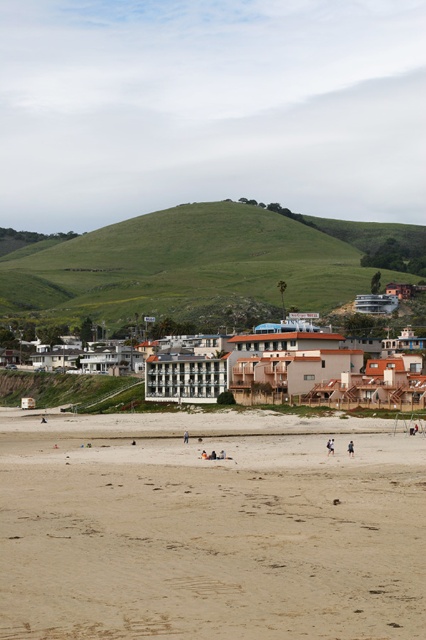
You are standing on the sandy beach in the foreground and want to reach the green grassy hillside at upper center. Which direction should you walk to get there?

The green grassy hillside at upper center is located at point (196,266), so you should walk towards the upper center direction to reach it.

You are standing at the point marked as point (43, 257) on a map of the beach. You want to walk to the water. Is the path from your current location to the water uphill or downhill?

The path from point (43, 257) to the water is downhill because the beach has a gentle slope leading up to the beach from the waterline, meaning the water is at a lower elevation than the beach area. Since you are at point (43, 257), which is 1746.14 feet away from the viewer, and the slope leads up from the water to the beach, moving towards the water would be going downhill.

You are standing on the beach and want to place your light brown wooden surfboard at center so that it faces the green grassy hillside at upper center. Is the surfboard currently positioned in a way that allows it to face the hillside without obstruction?

The light brown wooden surfboard at center is behind the green grassy hillside at upper center, so it cannot face the hillside directly as it would be blocked by the hillside itself.